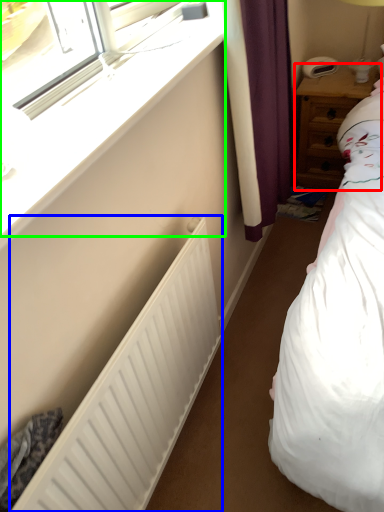
Question: Which is farther away from nightstand (highlighted by a red box)? radiator (highlighted by a blue box) or window (highlighted by a green box)?

Choices:
 (A) radiator
 (B) window

Answer: (A)